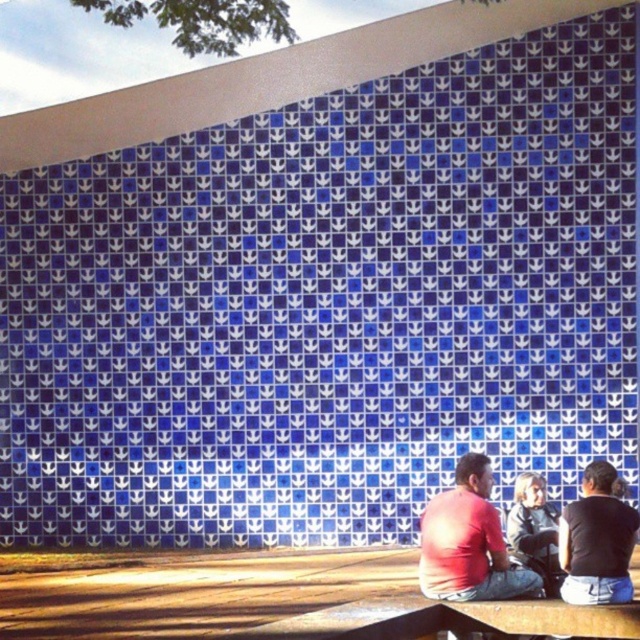
Does matte red shirt at lower center have a lesser width compared to black matte shirt at lower right?

No, matte red shirt at lower center is not thinner than black matte shirt at lower right.

Is matte red shirt at lower center wider than black matte shirt at lower right?

Yes.

Between point (458, 529) and point (580, 557), which one is positioned behind?

The point (458, 529) is more distant.

This screenshot has height=640, width=640. Find the location of `matte red shirt at lower center`. matte red shirt at lower center is located at coordinates (468, 541).